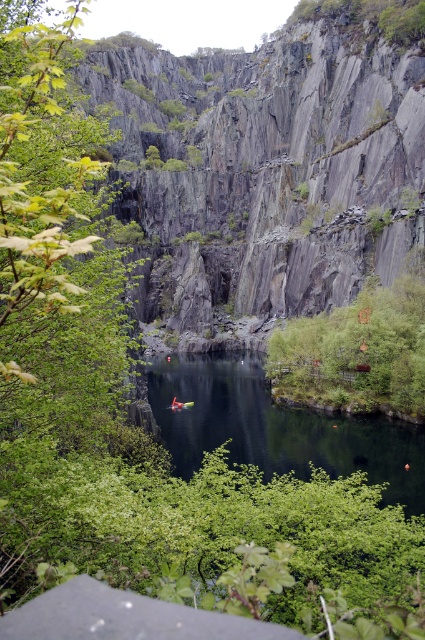
Who is positioned more to the left, greenish reflective water at center or green leafy tree at center-right?

greenish reflective water at center

Which of these two, greenish reflective water at center or green leafy tree at center-right, stands taller?

With more height is green leafy tree at center-right.

Does point (167, 394) come behind point (407, 348)?

Yes, point (167, 394) is farther from viewer.

Locate an element on the screen. This screenshot has width=425, height=640. greenish reflective water at center is located at coordinates (277, 428).